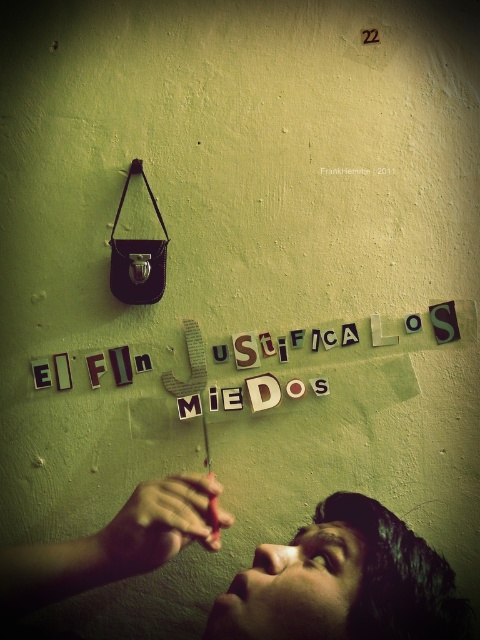
You are an artist who wants to place a new sculpture between the wooden letters at center and the smooth skin hand at lower center. Based on their positions, which object should the sculpture be closer to?

The wooden letters at center is positioned on the right side of smooth skin hand at lower center, so the sculpture should be placed closer to the smooth skin hand at lower center to maintain symmetry between them.

You are an artist trying to hang a new piece on the wall. You have a small nail and want to place it so that the nail is between the wooden letters at center and the smooth skin hand at lower center. Given their sizes, where should you place the nail to ensure there is enough space between them?

The wooden letters at center are wider than the smooth skin hand at lower center. To ensure enough space between them, place the nail closer to the smooth skin hand at lower center since its smaller size requires less spacing compared to the wider wooden letters at center.